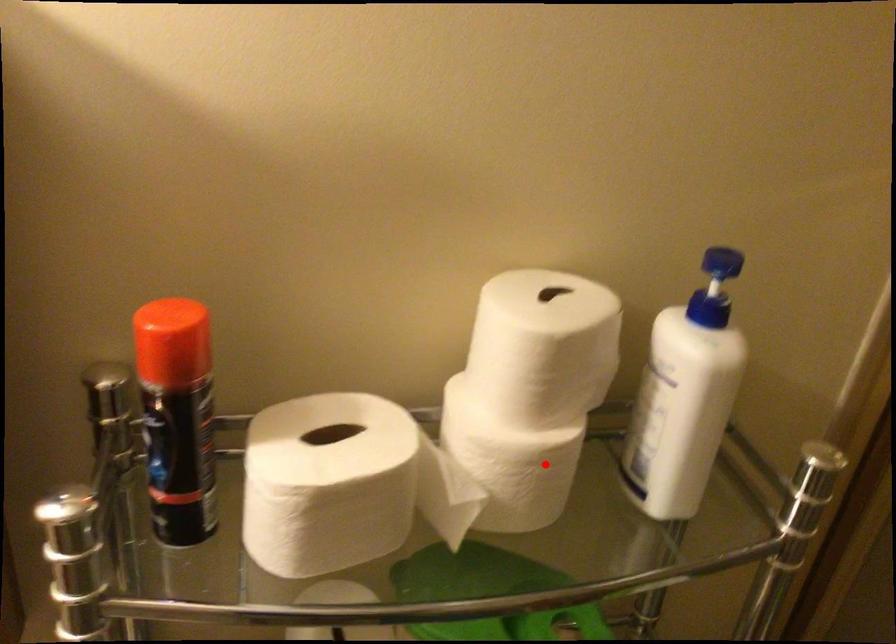
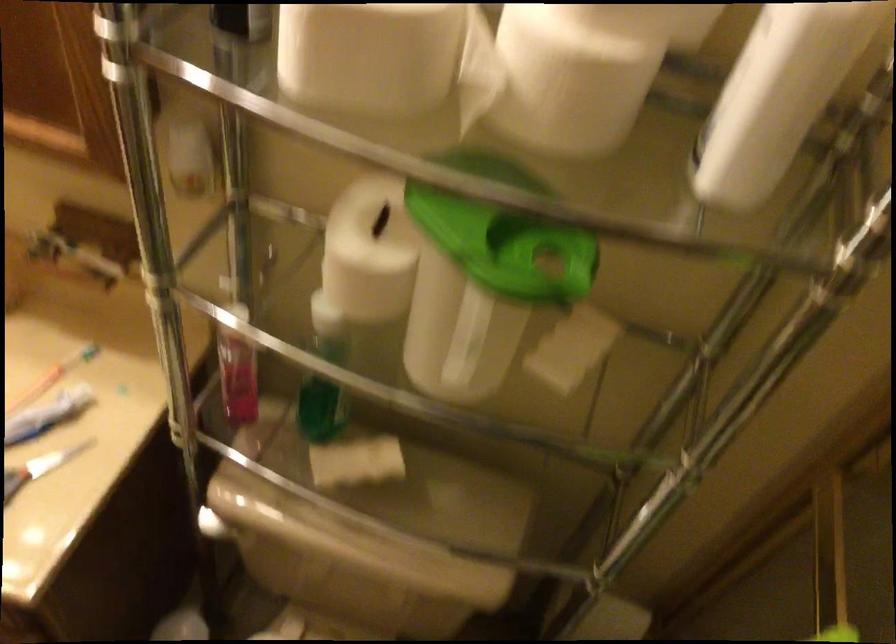
Find the pixel in the second image that matches the highlighted location in the first image.

(575, 73)